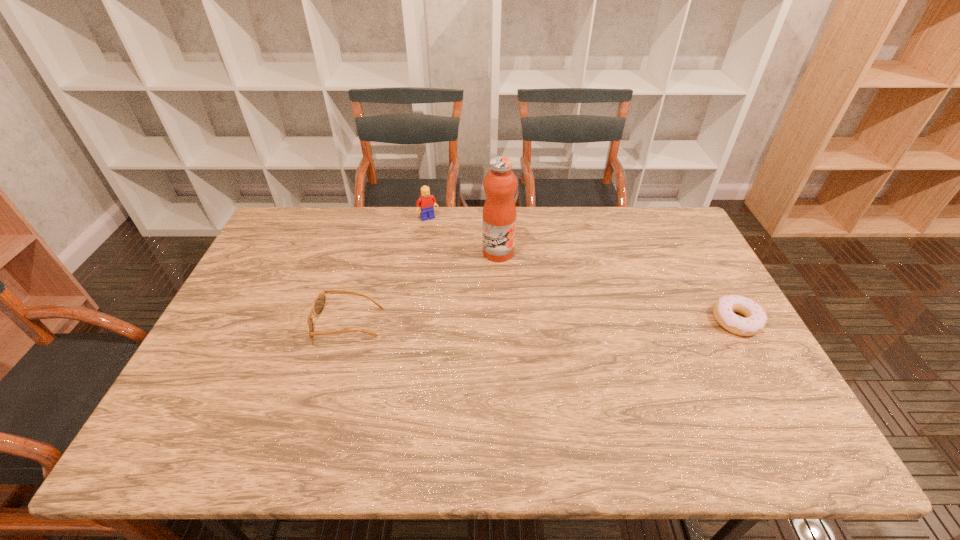
This screenshot has height=540, width=960. What are the coordinates of `object situated at the right edge` in the screenshot? It's located at (755, 321).

Where is `vacant space at the far edge`? vacant space at the far edge is located at coordinates (541, 213).

The height and width of the screenshot is (540, 960). In order to click on vacant space at the near edge in this screenshot , I will do click(307, 409).

The image size is (960, 540). What are the coordinates of `blank space at the left edge` in the screenshot? It's located at (300, 269).

This screenshot has height=540, width=960. In order to click on free region at the right edge of the desktop in this screenshot , I will do `click(669, 269)`.

This screenshot has height=540, width=960. I want to click on vacant space at the far left corner of the desktop, so click(297, 224).

You are a GUI agent. You are given a task and a screenshot of the screen. Output one action in this format:
    pyautogui.click(x=<x>, y=<y>)
    Task: Click on the free space at the far right corner of the desktop
    The width and height of the screenshot is (960, 540).
    Given the screenshot: What is the action you would take?
    pyautogui.click(x=663, y=220)

At what (x,y) coordinates should I click in order to perform the action: click on blank space at the near right corner. Please return your answer as a coordinate pair (x, y). The image size is (960, 540). Looking at the image, I should click on [729, 383].

Where is `vacant area that lies between the rightmost object and the sunglasses`? The width and height of the screenshot is (960, 540). vacant area that lies between the rightmost object and the sunglasses is located at coordinates (542, 322).

At what (x,y) coordinates should I click in order to perform the action: click on free area in between the fruit juice and the Lego. Please return your answer as a coordinate pair (x, y). The image size is (960, 540). Looking at the image, I should click on (463, 235).